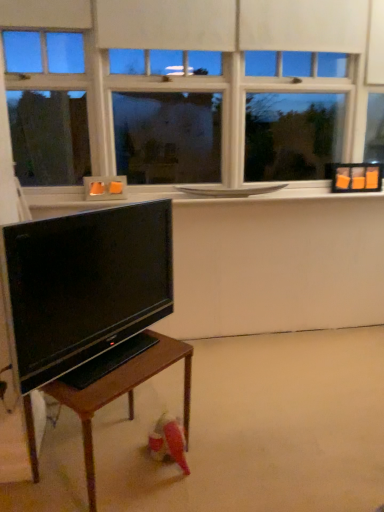
Identify the location of white matte window at upper center. (191, 90).

Locate an element on the screen. The image size is (384, 512). wooden table at lower left is located at coordinates [x=123, y=393].

What do you see at coordinates (178, 197) in the screenshot? The image size is (384, 512). I see `white glossy window sill at upper center` at bounding box center [178, 197].

At what (x,y) coordinates should I click in order to perform the action: click on matte black tv at lower left. Please return your answer as a coordinate pair (x, y). This screenshot has height=512, width=384. Looking at the image, I should click on (85, 285).

Is wooden table at lower left shorter than white matte window at upper center?

Yes, wooden table at lower left is shorter than white matte window at upper center.

From a real-world perspective, is wooden table at lower left physically located above or below white matte window at upper center?

Clearly, from a real-world perspective, wooden table at lower left is below white matte window at upper center.

What are the coordinates of `window on the right of wooden table at lower left` in the screenshot? It's located at (191, 90).

Measure the distance between wooden table at lower left and white matte window at upper center.

The distance of wooden table at lower left from white matte window at upper center is 5.63 feet.

Does white glossy window sill at upper center turn towards matte black tv at lower left?

No, white glossy window sill at upper center is not aimed at matte black tv at lower left.

Are white glossy window sill at upper center and matte black tv at lower left beside each other?

No, white glossy window sill at upper center is not making contact with matte black tv at lower left.

Is matte black tv at lower left surrounded by white glossy window sill at upper center?

Actually, matte black tv at lower left is outside white glossy window sill at upper center.

Is white glossy window sill at upper center oriented away from white matte window at upper center?

That's not correct — white glossy window sill at upper center is not looking away from white matte window at upper center.

From the image's perspective, does white glossy window sill at upper center appear higher than white matte window at upper center?

No, from the image's perspective, white glossy window sill at upper center is not on top of white matte window at upper center.

Between white glossy window sill at upper center and white matte window at upper center, which one has smaller size?

white glossy window sill at upper center is smaller.

Does wooden table at lower left appear on the right side of matte black tv at lower left?

Yes, wooden table at lower left is to the right of matte black tv at lower left.

Which object is wider, wooden table at lower left or matte black tv at lower left?

With larger width is wooden table at lower left.

Are wooden table at lower left and matte black tv at lower left located far from each other?

wooden table at lower left is actually quite close to matte black tv at lower left.

Measure the distance from wooden table at lower left to matte black tv at lower left.

wooden table at lower left and matte black tv at lower left are 11.60 inches apart.

Is white matte window at upper center next to white glossy window sill at upper center and touching it?

white matte window at upper center and white glossy window sill at upper center are not in contact.

Does white matte window at upper center have a greater width compared to white glossy window sill at upper center?

No.

What's the angular difference between white matte window at upper center and white glossy window sill at upper center's facing directions?

The angular difference between white matte window at upper center and white glossy window sill at upper center is 0.000687 degrees.

Is point (194, 120) closer or farther from the camera than point (136, 199)?

Point (194, 120) appears to be farther away from the viewer than point (136, 199).

Is matte black tv at lower left completely or partially outside of wooden table at lower left?

matte black tv at lower left is positioned outside wooden table at lower left.

Does matte black tv at lower left have a smaller size compared to wooden table at lower left?

Indeed, matte black tv at lower left has a smaller size compared to wooden table at lower left.

Does point (20, 266) come behind point (176, 355)?

No, (20, 266) is closer to viewer.

Is matte black tv at lower left taller or shorter than wooden table at lower left?

matte black tv at lower left is taller than wooden table at lower left.

Is matte black tv at lower left positioned with its back to white glossy window sill at upper center?

No.

Between matte black tv at lower left and white glossy window sill at upper center, which one appears on the right side from the viewer's perspective?

From the viewer's perspective, white glossy window sill at upper center appears more on the right side.

Between matte black tv at lower left and white glossy window sill at upper center, which one has larger size?

matte black tv at lower left is bigger.

Is matte black tv at lower left far away from white glossy window sill at upper center?

Yes, matte black tv at lower left and white glossy window sill at upper center are quite far apart.

Where is `table below the white matte window at upper center (from the image's perspective)`? table below the white matte window at upper center (from the image's perspective) is located at coordinates (123, 393).

Find the location of a particular element. The width and height of the screenshot is (384, 512). window sill on the right of matte black tv at lower left is located at coordinates (178, 197).

Considering their positions, is white glossy window sill at upper center positioned closer to white matte window at upper center than wooden table at lower left?

The object closer to white matte window at upper center is white glossy window sill at upper center.

From the image, which object appears to be farther from white matte window at upper center, white glossy window sill at upper center or matte black tv at lower left?

The object further to white matte window at upper center is matte black tv at lower left.

Based on their spatial positions, is white matte window at upper center or white glossy window sill at upper center closer to wooden table at lower left?

Based on the image, white glossy window sill at upper center appears to be nearer to wooden table at lower left.

When comparing their distances from matte black tv at lower left, does wooden table at lower left or white matte window at upper center seem further?

white matte window at upper center is positioned further to the anchor matte black tv at lower left.

From the image, which object appears to be nearer to white glossy window sill at upper center, wooden table at lower left or matte black tv at lower left?

Based on the image, matte black tv at lower left appears to be nearer to white glossy window sill at upper center.

From the picture: From the image, which object appears to be nearer to white matte window at upper center, matte black tv at lower left or white glossy window sill at upper center?

The object closer to white matte window at upper center is white glossy window sill at upper center.

Estimate the real-world distances between objects in this image. Which object is closer to wooden table at lower left, matte black tv at lower left or white glossy window sill at upper center?

matte black tv at lower left is closer to wooden table at lower left.

Which object lies further to the anchor point matte black tv at lower left, white glossy window sill at upper center or white matte window at upper center?

white matte window at upper center is further to matte black tv at lower left.

I want to click on window sill that lies between white matte window at upper center and wooden table at lower left from top to bottom, so click(x=178, y=197).

Find the location of a particular element. Image resolution: width=384 pixels, height=512 pixels. window between matte black tv at lower left and white glossy window sill at upper center along the z-axis is located at coordinates (191, 90).

The width and height of the screenshot is (384, 512). I want to click on television between white matte window at upper center and wooden table at lower left in the up-down direction, so click(x=85, y=285).

Where is `table between matte black tv at lower left and white glossy window sill at upper center along the z-axis`? This screenshot has width=384, height=512. table between matte black tv at lower left and white glossy window sill at upper center along the z-axis is located at coordinates (123, 393).